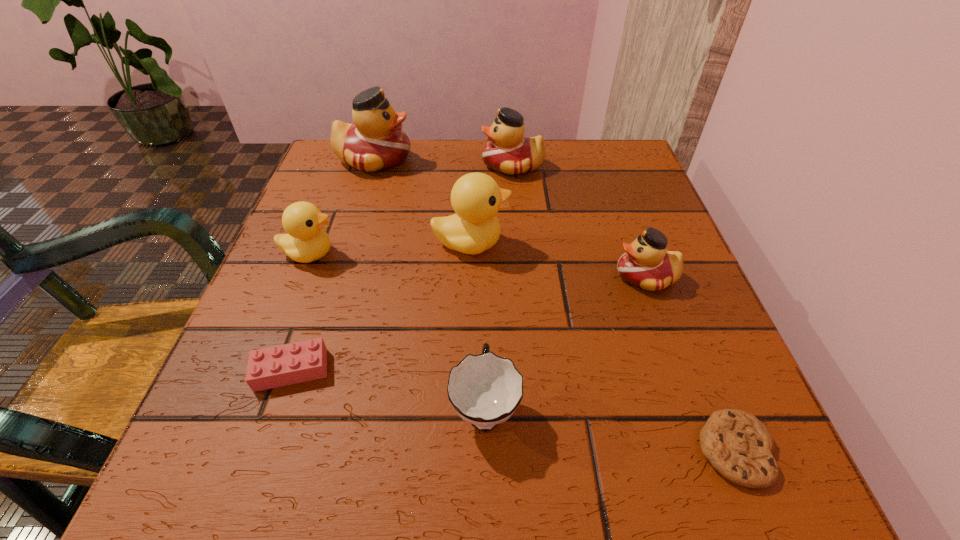
What are the coordinates of `the biggest red duck` in the screenshot? It's located at (375, 142).

In order to click on the bigger yellow duck in this screenshot , I will do `click(476, 198)`.

The image size is (960, 540). In order to click on the second biggest red duck in this screenshot , I will do `click(508, 152)`.

This screenshot has height=540, width=960. I want to click on the left yellow duck, so click(x=306, y=241).

Image resolution: width=960 pixels, height=540 pixels. Identify the location of the rightmost duck. (646, 264).

This screenshot has width=960, height=540. Identify the location of the nearest red duck. (646, 264).

Find the location of `cup`. cup is located at coordinates (485, 390).

Identify the location of the third shortest object. (485, 390).

Find the location of a particular element. The width and height of the screenshot is (960, 540). the second shortest object is located at coordinates (303, 361).

The image size is (960, 540). I want to click on Lego, so click(303, 361).